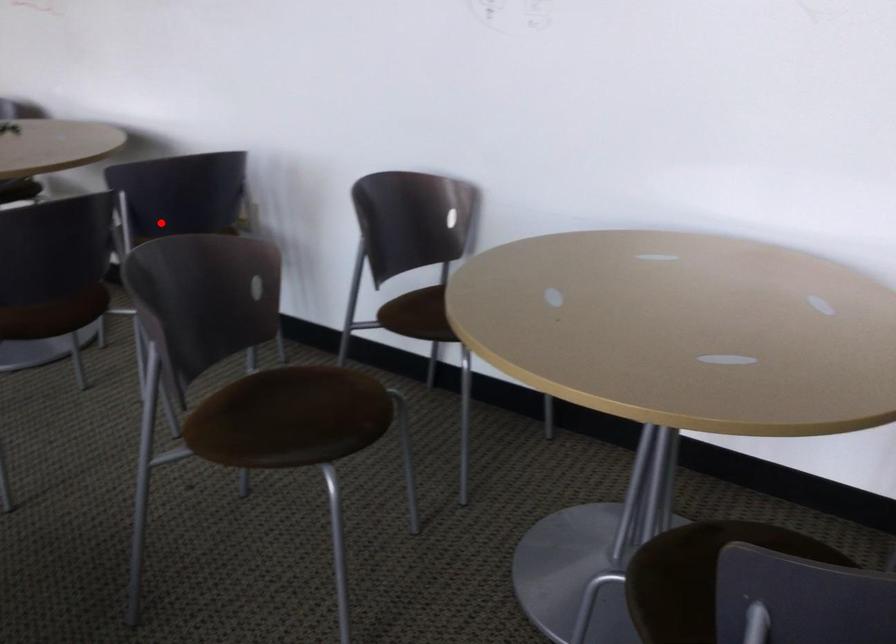
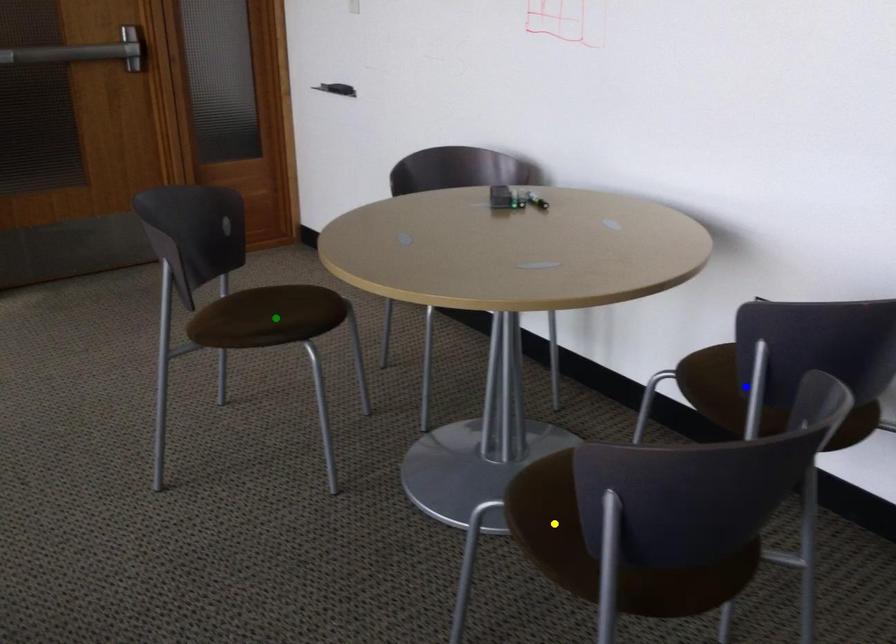
Question: I am providing you with two images of the same scene from different viewpoints. A red point is marked on the first image. You are given multiple points on the second image. Which point in image 2 represents the same 3d spot as the red point in image 1?

Choices:
 (A) green point
 (B) yellow point
 (C) blue point

Answer: (C)